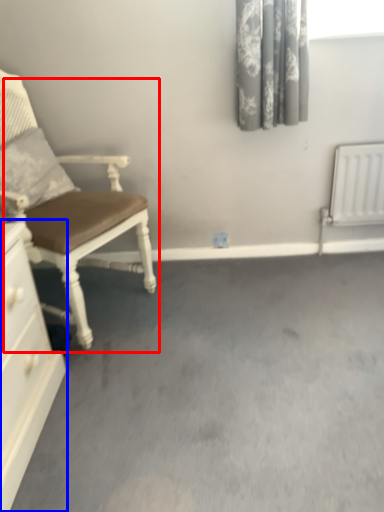
Question: Which of the following is the closest to the observer, chair (highlighted by a red box) or chest of drawers (highlighted by a blue box)?

Choices:
 (A) chair
 (B) chest of drawers

Answer: (B)